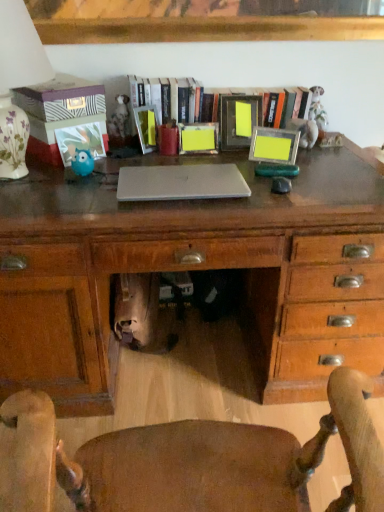
This screenshot has height=512, width=384. Find the location of `matte plastic picture frame at upper center, arranged as the second picture frame when viewed from the left`. matte plastic picture frame at upper center, arranged as the second picture frame when viewed from the left is located at coordinates (146, 127).

Find the location of a particular element. The width and height of the screenshot is (384, 512). matte blue owl at left, marked as the 5th picture frame in a right-to-left arrangement is located at coordinates (80, 141).

Describe the element at coordinates (188, 461) in the screenshot. I see `wooden chair at center` at that location.

From the picture: Measure the distance between point (123, 125) and camera.

5.52 feet.

Measure the distance between matte wooden desk at center and camera.

Result: 1.16 meters.

Describe the element at coordinates (193, 270) in the screenshot. I see `matte wooden desk at center` at that location.

The width and height of the screenshot is (384, 512). In order to click on matte plastic picture frame at upper center, arranged as the second picture frame when viewed from the left in this screenshot , I will do `click(146, 127)`.

Measure the distance between yellow matte picture frame at center, acting as the third picture frame starting from the left, and satin silver laptop at center.

A distance of 13.99 inches exists between yellow matte picture frame at center, acting as the third picture frame starting from the left, and satin silver laptop at center.

From the image's perspective, is yellow matte picture frame at center, which appears as the third picture frame when viewed from the right, on top of satin silver laptop at center?

Yes.

What's the angular difference between yellow matte picture frame at center, acting as the third picture frame starting from the left, and satin silver laptop at center's facing directions?

There is a 3.51-degree angle between the facing directions of yellow matte picture frame at center, acting as the third picture frame starting from the left, and satin silver laptop at center.

Is yellow matte picture frame at center, acting as the third picture frame starting from the left, far away from satin silver laptop at center?

No.

From the image's perspective, which is above, satin silver laptop at center or wooden chair at center?

satin silver laptop at center, from the image's perspective.

Is wooden chair at center at the back of satin silver laptop at center?

No, satin silver laptop at center is not facing away from wooden chair at center.

Is satin silver laptop at center completely or partially outside of wooden chair at center?

Yes, satin silver laptop at center is located beyond the bounds of wooden chair at center.

From a real-world perspective, does satin silver laptop at center sit lower than wooden chair at center?

No, from a real-world perspective, satin silver laptop at center is not under wooden chair at center.

Which of these two, porcelain floral table lamp at upper left or satin silver laptop at center, is thinner?

satin silver laptop at center.

Is point (0, 89) in front of point (230, 188)?

Yes, it is.

Looking at this image, is porcelain floral table lamp at upper left next to satin silver laptop at center and touching it?

No, porcelain floral table lamp at upper left is not beside satin silver laptop at center.

Can you tell me how much matte blue owl at left, which is counted as the 1th toy, starting from the bottom, and wooden chair at center differ in facing direction?

174 degrees separate the facing orientations of matte blue owl at left, which is counted as the 1th toy, starting from the bottom, and wooden chair at center.

Does matte blue owl at left, acting as the 2th toy starting from the top, contain wooden chair at center?

No.

Is matte blue owl at left, acting as the 2th toy starting from the top, positioned far away from wooden chair at center?

Absolutely, matte blue owl at left, acting as the 2th toy starting from the top, is distant from wooden chair at center.

Considering the relative sizes of matte blue owl at left, positioned as the 1th toy in front-to-back order, and wooden chair at center in the image provided, is matte blue owl at left, positioned as the 1th toy in front-to-back order, taller than wooden chair at center?

No, matte blue owl at left, positioned as the 1th toy in front-to-back order, is not taller than wooden chair at center.

Which object is positioned more to the left, metallic silver picture frame at center, which is the second picture frame in right-to-left order, or matte blue owl at left, marked as the 2th toy in a back-to-front arrangement?

Positioned to the left is matte blue owl at left, marked as the 2th toy in a back-to-front arrangement.

This screenshot has width=384, height=512. I want to click on toy in front of the metallic silver picture frame at center, the 4th picture frame from the left, so click(x=82, y=162).

From the image's perspective, is metallic silver picture frame at center, the 4th picture frame from the left, under matte blue owl at left, which is counted as the 1th toy, starting from the bottom?

Actually, metallic silver picture frame at center, the 4th picture frame from the left, appears above matte blue owl at left, which is counted as the 1th toy, starting from the bottom, in the image.

Does point (259, 100) lie behind point (92, 166)?

That is True.

From the picture: From the image's perspective, between satin silver laptop at center and yellow matte picture frame at center, acting as the third picture frame starting from the left, which one is located above?

From the image's view, yellow matte picture frame at center, acting as the third picture frame starting from the left, is above.

Considering the positions of objects satin silver laptop at center and yellow matte picture frame at center, which appears as the third picture frame when viewed from the right, in the image provided, who is more to the right, satin silver laptop at center or yellow matte picture frame at center, which appears as the third picture frame when viewed from the right,?

From the viewer's perspective, yellow matte picture frame at center, which appears as the third picture frame when viewed from the right, appears more on the right side.

In terms of size, does satin silver laptop at center appear bigger or smaller than yellow matte picture frame at center, which appears as the third picture frame when viewed from the right?

Considering their sizes, satin silver laptop at center takes up more space than yellow matte picture frame at center, which appears as the third picture frame when viewed from the right.

How distant is satin silver laptop at center from yellow matte picture frame at center, acting as the third picture frame starting from the left?

13.99 inches.

Consider the image. Between matte wooden desk at center and wooden frame at center, which one has smaller width?

wooden frame at center is thinner.

Which is behind, point (362, 196) or point (266, 105)?

Positioned behind is point (266, 105).

Based on the photo, is matte wooden desk at center to the left or to the right of wooden frame at center in the image?

Based on their positions, matte wooden desk at center is located to the left of wooden frame at center.

From a real-world perspective, is matte wooden desk at center above or below wooden frame at center?

Clearly, from a real-world perspective, matte wooden desk at center is below wooden frame at center.

This screenshot has height=512, width=384. Identify the location of the 1st picture frame above the satin silver laptop at center (from a real-world perspective). (198, 138).

In order to click on chair below the satin silver laptop at center (from a real-world perspective) in this screenshot , I will do `click(188, 461)`.

In the scene shown: When comparing their distances from yellow matte picture frame at center, which appears as the third picture frame when viewed from the right, does satin silver laptop at center or matte wooden desk at center seem further?

matte wooden desk at center.

Looking at the image, which one is located further to wooden chair at center, metallic silver picture frame at center, which ranks as the first picture frame in right-to-left order, or wooden frame at center?

wooden frame at center.

Considering their positions, is wooden frame at center positioned closer to matte blue owl at left, acting as the 2th toy starting from the top, than porcelain floral table lamp at upper left?

Among the two, porcelain floral table lamp at upper left is located nearer to matte blue owl at left, acting as the 2th toy starting from the top.

Based on their spatial positions, is wooden frame at center or porcelain floral table lamp at upper left closer to satin silver laptop at center?

Among the two, porcelain floral table lamp at upper left is located nearer to satin silver laptop at center.

Looking at the image, which one is located closer to porcelain floral table lamp at upper left, yellow matte picture frame at center, which appears as the third picture frame when viewed from the right, or matte blue owl at left, which is the 1th picture frame from left to right?

matte blue owl at left, which is the 1th picture frame from left to right, is positioned closer to the anchor porcelain floral table lamp at upper left.

Estimate the real-world distances between objects in this image. Which object is further from matte wooden desk at center, yellow matte picture frame at center, acting as the third picture frame starting from the left, or wooden chair at center?

Based on the image, wooden chair at center appears to be further to matte wooden desk at center.

Based on their spatial positions, is matte blue owl at left, positioned as the 1th toy in front-to-back order, or metallic silver picture frame at center, which is the second picture frame in right-to-left order, closer to wooden chair at center?

The object closer to wooden chair at center is matte blue owl at left, positioned as the 1th toy in front-to-back order.

Which object lies nearer to the anchor point yellow matte picture frame at center, which appears as the third picture frame when viewed from the right, matte plastic picture frame at upper center, arranged as the second picture frame when viewed from the left, or metallic silver picture frame at center, acting as the fifth picture frame starting from the left?

The object closer to yellow matte picture frame at center, which appears as the third picture frame when viewed from the right, is matte plastic picture frame at upper center, arranged as the second picture frame when viewed from the left.

Identify the location of desk located between wooden chair at center and metallic silver picture frame at center, which is the second picture frame in right-to-left order, in the depth direction. The height and width of the screenshot is (512, 384). (193, 270).

The image size is (384, 512). Find the location of `toy between wooden chair at center and matte blue owl at left, marked as the 5th picture frame in a right-to-left arrangement, along the z-axis`. toy between wooden chair at center and matte blue owl at left, marked as the 5th picture frame in a right-to-left arrangement, along the z-axis is located at coordinates (82, 162).

The width and height of the screenshot is (384, 512). Identify the location of toy located between porcelain floral table lamp at upper left and matte blue owl at left, marked as the 5th picture frame in a right-to-left arrangement, in the depth direction. (82, 162).

Locate an element on the screen. desk between wooden chair at center and metallic silver picture frame at center, acting as the fifth picture frame starting from the left, in the front-back direction is located at coordinates (193, 270).